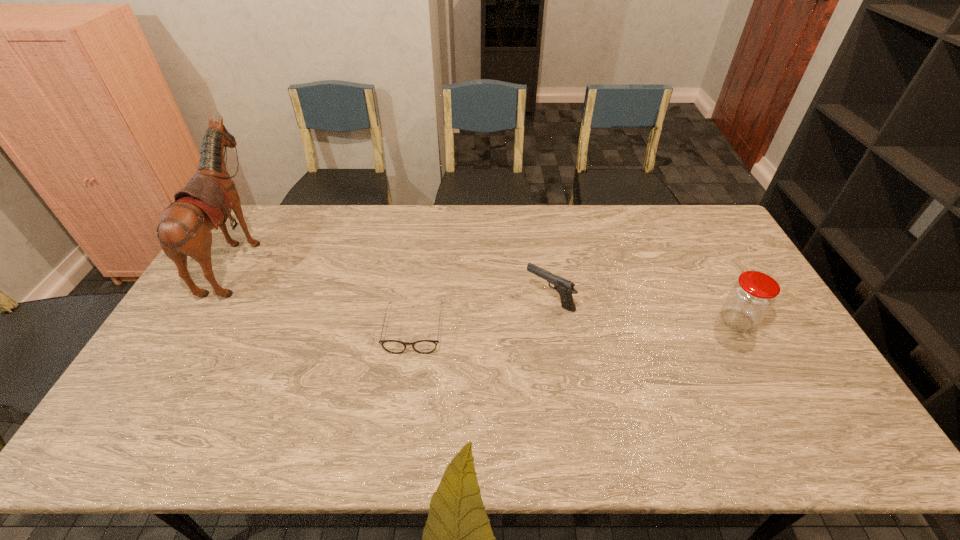
Identify the location of blank space at the left edge of the desktop. This screenshot has height=540, width=960. (228, 268).

The image size is (960, 540). In the image, there is a desktop. Find the location of `vacant space at the right edge`. vacant space at the right edge is located at coordinates (714, 259).

Identify the location of vacant space that is in between the jar and the saddle. The height and width of the screenshot is (540, 960). (489, 288).

What are the coordinates of `vacant space that is in between the third object from right to left and the rightmost object` in the screenshot? It's located at (575, 325).

I want to click on vacant region between the spectacles and the tallest object, so click(x=326, y=293).

Locate an element on the screen. The image size is (960, 540). vacant space that is in between the rightmost object and the third tallest object is located at coordinates (643, 310).

Image resolution: width=960 pixels, height=540 pixels. Identify the location of free space between the rightmost object and the second object from left to right. (575, 325).

The width and height of the screenshot is (960, 540). In order to click on vacant space that is in between the jar and the gun in this screenshot , I will do `click(643, 310)`.

Find the location of a particular element. This screenshot has height=540, width=960. vacant space that's between the second shortest object and the saddle is located at coordinates (395, 278).

At what (x,y) coordinates should I click in order to perform the action: click on free space between the leftmost object and the third object from left to right. Please return your answer as a coordinate pair (x, y). The width and height of the screenshot is (960, 540). Looking at the image, I should click on (395, 278).